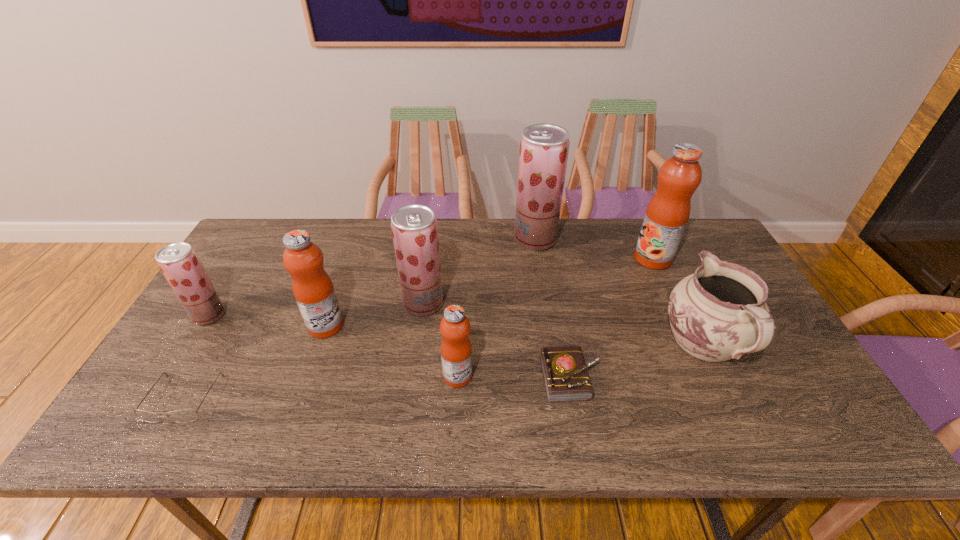
Where is `free space that is in between the diary and the pitcher`? free space that is in between the diary and the pitcher is located at coordinates (637, 361).

I want to click on vacant space in between the rightmost fruit juice and the farthest strawberry fruit juice, so click(594, 249).

You are a GUI agent. You are given a task and a screenshot of the screen. Output one action in this format:
    pyautogui.click(x=<x>, y=<y>)
    Task: Click on the unoccupied area between the diary and the farthest orange fruit juice
    This screenshot has height=540, width=960.
    Given the screenshot: What is the action you would take?
    pyautogui.click(x=612, y=318)

Image resolution: width=960 pixels, height=540 pixels. Identify the location of object that can be found as the closest to the pitcher. (667, 214).

The image size is (960, 540). What are the coordinates of `object identified as the fifth closest to the pitcher` in the screenshot? It's located at (414, 229).

Select which fruit juice is the second closest to the spectacles. Please provide its 2D coordinates. Your answer should be formatted as a tuple, i.e. [(x, y)], where the tuple contains the x and y coordinates of a point satisfying the conditions above.

[(313, 289)]

Identify which fruit juice is the fifth closest to the rightmost orange fruit juice. Please provide its 2D coordinates. Your answer should be formatted as a tuple, i.e. [(x, y)], where the tuple contains the x and y coordinates of a point satisfying the conditions above.

[(179, 263)]

The height and width of the screenshot is (540, 960). Find the location of `strawberry fruit juice that can be found as the second closest to the beige spectacles`. strawberry fruit juice that can be found as the second closest to the beige spectacles is located at coordinates (414, 229).

Identify which strawberry fruit juice is located as the nearest to the purple pitcher. Please provide its 2D coordinates. Your answer should be formatted as a tuple, i.e. [(x, y)], where the tuple contains the x and y coordinates of a point satisfying the conditions above.

[(544, 148)]

Identify the location of orange fruit juice that is the second closest to the second orange fruit juice from left to right. (667, 214).